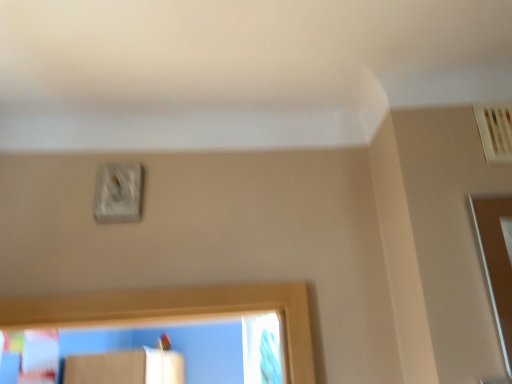
The height and width of the screenshot is (384, 512). Identify the location of clear glass screen door at right. (497, 262).

What do you see at coordinates (497, 262) in the screenshot?
I see `clear glass screen door at right` at bounding box center [497, 262].

In order to face white textured switch at upper center, should I rotate leftwards or rightwards?

It's best to rotate left around 17.501 degrees.

What is the approximate height of white textured switch at upper center?

white textured switch at upper center is 6.97 inches in height.

Locate an element on the screen. The width and height of the screenshot is (512, 384). white textured switch at upper center is located at coordinates [118, 193].

What do you see at coordinates (118, 193) in the screenshot? I see `white textured switch at upper center` at bounding box center [118, 193].

The width and height of the screenshot is (512, 384). Identify the location of clear glass screen door at right. (497, 262).

Considering the relative positions of clear glass screen door at right and white textured switch at upper center in the image provided, is clear glass screen door at right to the left of white textured switch at upper center from the viewer's perspective?

Incorrect, clear glass screen door at right is not on the left side of white textured switch at upper center.

Considering their positions, is clear glass screen door at right located in front of or behind white textured switch at upper center?

Visually, clear glass screen door at right is located in front of white textured switch at upper center.

Between point (498, 265) and point (106, 175), which one is positioned in front?

The point (498, 265) is more forward.

From the image's perspective, is clear glass screen door at right located beneath white textured switch at upper center?

Indeed, from the image's perspective, clear glass screen door at right is shown beneath white textured switch at upper center.

From a real-world perspective, who is located lower, clear glass screen door at right or white textured switch at upper center?

clear glass screen door at right is physically lower.

Which of these two, clear glass screen door at right or white textured switch at upper center, is wider?

Wider between the two is clear glass screen door at right.

From their relative heights in the image, would you say clear glass screen door at right is taller or shorter than white textured switch at upper center?

Considering their sizes, clear glass screen door at right has more height than white textured switch at upper center.

Considering the sizes of objects clear glass screen door at right and white textured switch at upper center in the image provided, who is bigger, clear glass screen door at right or white textured switch at upper center?

clear glass screen door at right is bigger.

Would you say white textured switch at upper center is part of clear glass screen door at right's contents?

No, white textured switch at upper center is located outside of clear glass screen door at right.

Is clear glass screen door at right positioned far away from white textured switch at upper center?

clear glass screen door at right is actually quite close to white textured switch at upper center.

Is clear glass screen door at right facing towards white textured switch at upper center?

No, clear glass screen door at right is not turned towards white textured switch at upper center.

What's the angular difference between clear glass screen door at right and white textured switch at upper center's facing directions?

1.93 degrees.

Measure the distance between clear glass screen door at right and white textured switch at upper center.

A distance of 36.35 inches exists between clear glass screen door at right and white textured switch at upper center.

Image resolution: width=512 pixels, height=384 pixels. In the image, there is a clear glass screen door at right. Identify the location of light switch above it (from the image's perspective). (118, 193).

In the image, is white textured switch at upper center on the left side or the right side of clear glass screen door at right?

Clearly, white textured switch at upper center is on the left of clear glass screen door at right in the image.

Between white textured switch at upper center and clear glass screen door at right, which one is positioned behind?

white textured switch at upper center is behind.

Between point (118, 197) and point (492, 280), which one is positioned in front?

The point (492, 280) is more forward.

From the image's perspective, is white textured switch at upper center located above clear glass screen door at right?

Yes, from the image's perspective, white textured switch at upper center is on top of clear glass screen door at right.

From a real-world perspective, is white textured switch at upper center positioned above or below clear glass screen door at right?

In terms of real-world spatial position, white textured switch at upper center is above clear glass screen door at right.

Considering the sizes of objects white textured switch at upper center and clear glass screen door at right in the image provided, who is thinner, white textured switch at upper center or clear glass screen door at right?

With smaller width is white textured switch at upper center.

Considering the sizes of white textured switch at upper center and clear glass screen door at right in the image, is white textured switch at upper center taller or shorter than clear glass screen door at right?

white textured switch at upper center is shorter than clear glass screen door at right.

Which of these two, white textured switch at upper center or clear glass screen door at right, is smaller?

With smaller size is white textured switch at upper center.

Is clear glass screen door at right surrounded by white textured switch at upper center?

No, clear glass screen door at right is located outside of white textured switch at upper center.

Is white textured switch at upper center far from clear glass screen door at right?

No.

Is white textured switch at upper center oriented away from clear glass screen door at right?

white textured switch at upper center is not turned away from clear glass screen door at right.

How many degrees apart are the facing directions of white textured switch at upper center and clear glass screen door at right?

1.93 degrees.

This screenshot has width=512, height=384. What are the coordinates of `screen door in front of the white textured switch at upper center` in the screenshot? It's located at (497, 262).

Find the location of a particular element. light switch above the clear glass screen door at right (from the image's perspective) is located at coordinates (118, 193).

I want to click on screen door below the white textured switch at upper center (from the image's perspective), so click(x=497, y=262).